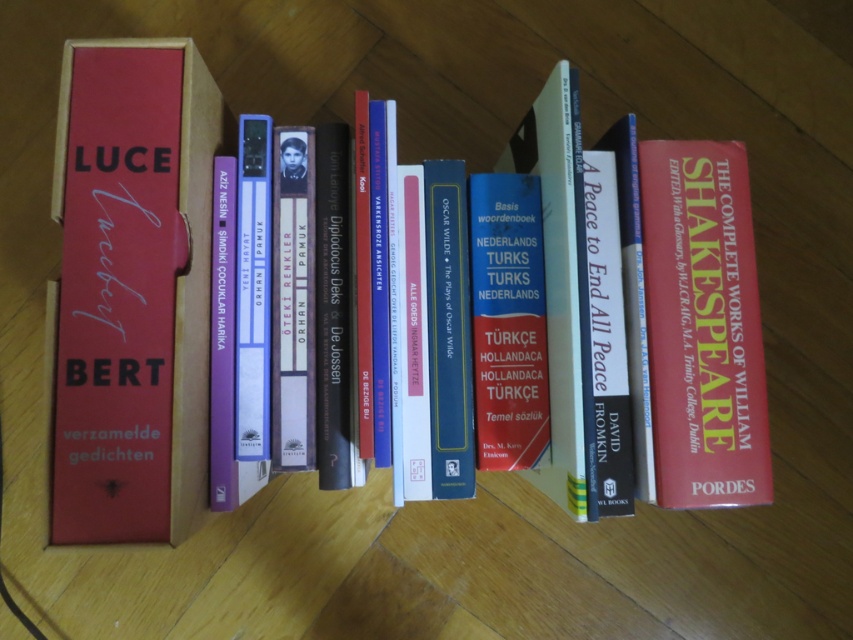
Question: Is hardcover books at center to the right of blue hardcover book at center from the viewer's perspective?

Choices:
 (A) yes
 (B) no

Answer: (B)

Question: Which point is farther to the camera?

Choices:
 (A) (714, 422)
 (B) (165, 147)
 (C) (288, 433)

Answer: (A)

Question: Is hardcover books at center to the right of matte purple binder at center from the viewer's perspective?

Choices:
 (A) no
 (B) yes

Answer: (A)

Question: Is matte red book at left below hardcover book at right?

Choices:
 (A) yes
 (B) no

Answer: (B)

Question: Which object is positioned closest to the matte purple binder at center?

Choices:
 (A) hardcover book at center
 (B) blue hardcover book at center

Answer: (A)

Question: Which point is closer to the camera?

Choices:
 (A) (302, 228)
 (B) (254, 275)

Answer: (B)